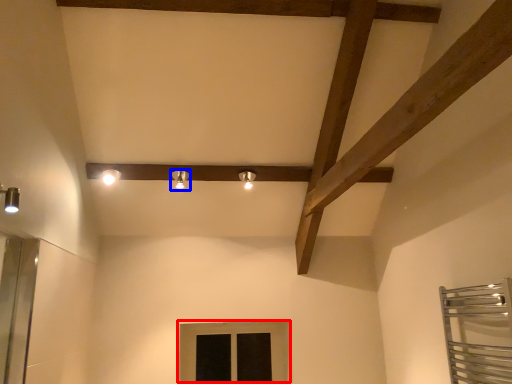
Question: Among these objects, which one is nearest to the camera, window (highlighted by a red box) or light fixture (highlighted by a blue box)?

Choices:
 (A) window
 (B) light fixture

Answer: (B)